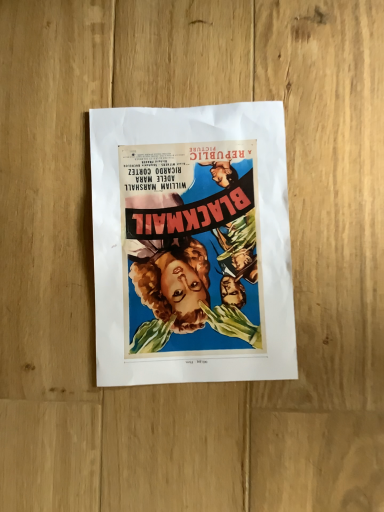
What is the approximate width of matte paper poster at center?

The width of matte paper poster at center is 30.74 centimeters.

At what (x,y) coordinates should I click in order to perform the action: click on matte paper poster at center. Please return your answer as a coordinate pair (x, y). This screenshot has height=512, width=384. Looking at the image, I should click on (191, 245).

What do you see at coordinates (191, 245) in the screenshot?
I see `matte paper poster at center` at bounding box center [191, 245].

Locate an element on the screen. This screenshot has height=512, width=384. matte paper poster at center is located at coordinates point(191,245).